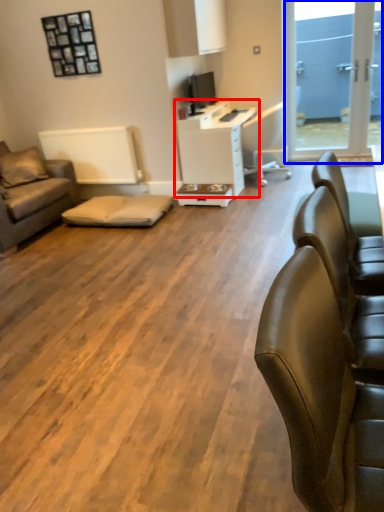
Question: Among these objects, which one is farthest to the camera, desk (highlighted by a red box) or window screen (highlighted by a blue box)?

Choices:
 (A) desk
 (B) window screen

Answer: (B)